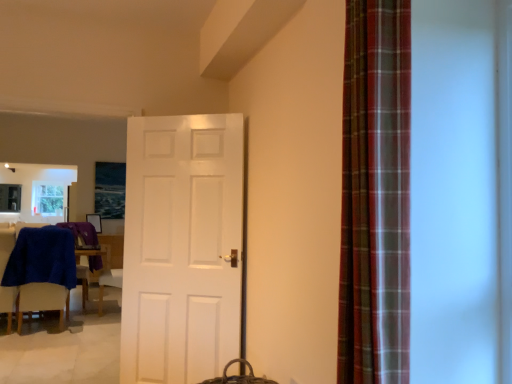
Question: Considering the relative sizes of plaid fabric curtain at right and blue fabric chair at left in the image provided, is plaid fabric curtain at right smaller than blue fabric chair at left?

Choices:
 (A) no
 (B) yes

Answer: (B)

Question: Can you confirm if plaid fabric curtain at right is positioned to the left of blue fabric chair at left?

Choices:
 (A) no
 (B) yes

Answer: (A)

Question: Is plaid fabric curtain at right turned away from blue fabric chair at left?

Choices:
 (A) no
 (B) yes

Answer: (A)

Question: From a real-world perspective, is plaid fabric curtain at right positioned over blue fabric chair at left based on gravity?

Choices:
 (A) no
 (B) yes

Answer: (B)

Question: Could you tell me if plaid fabric curtain at right is turned towards blue fabric chair at left?

Choices:
 (A) no
 (B) yes

Answer: (A)

Question: Considering the positions of white matte door at center and blue fabric chair at left in the image, is white matte door at center taller or shorter than blue fabric chair at left?

Choices:
 (A) short
 (B) tall

Answer: (B)

Question: From the image's perspective, relative to blue fabric chair at left, is white matte door at center above or below?

Choices:
 (A) above
 (B) below

Answer: (A)

Question: In the image, is white matte door at center positioned in front of or behind blue fabric chair at left?

Choices:
 (A) behind
 (B) front

Answer: (B)

Question: Would you say white matte door at center is inside or outside blue fabric chair at left?

Choices:
 (A) outside
 (B) inside

Answer: (A)

Question: Is white matte door at center wider or thinner than plaid fabric curtain at right?

Choices:
 (A) thin
 (B) wide

Answer: (A)

Question: Based on their positions, is white matte door at center located to the left or right of plaid fabric curtain at right?

Choices:
 (A) right
 (B) left

Answer: (B)

Question: From a real-world perspective, is white matte door at center positioned above or below plaid fabric curtain at right?

Choices:
 (A) below
 (B) above

Answer: (A)

Question: Is white matte door at center bigger or smaller than plaid fabric curtain at right?

Choices:
 (A) big
 (B) small

Answer: (A)

Question: Based on their sizes in the image, would you say plaid fabric curtain at right is bigger or smaller than blue fabric chair at left?

Choices:
 (A) big
 (B) small

Answer: (B)

Question: Based on their positions, is plaid fabric curtain at right located to the left or right of blue fabric chair at left?

Choices:
 (A) right
 (B) left

Answer: (A)